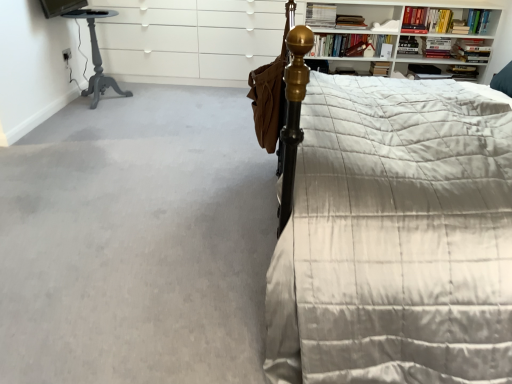
Question: Is matte gold bedpost at upper right further to camera compared to hardcover book at upper right, which is the seventh book in left-to-right order?

Choices:
 (A) yes
 (B) no

Answer: (B)

Question: From the image's perspective, does matte gold bedpost at upper right appear lower than hardcover book at upper right, arranged as the second book when viewed from the right?

Choices:
 (A) no
 (B) yes

Answer: (B)

Question: Is matte gold bedpost at upper right in contact with hardcover book at upper right, which is the seventh book in left-to-right order?

Choices:
 (A) yes
 (B) no

Answer: (B)

Question: Does matte gold bedpost at upper right have a greater width compared to hardcover book at upper right, which is the seventh book in left-to-right order?

Choices:
 (A) yes
 (B) no

Answer: (A)

Question: Is matte gold bedpost at upper right to the left of hardcover book at upper right, which is the seventh book in left-to-right order, from the viewer's perspective?

Choices:
 (A) no
 (B) yes

Answer: (B)

Question: From a real-world perspective, is matte gold bedpost at upper right above or below hardcover book at upper center, the 7th book positioned from the right?

Choices:
 (A) below
 (B) above

Answer: (A)

Question: Based on their sizes in the image, would you say matte gold bedpost at upper right is bigger or smaller than hardcover book at upper center, the 7th book positioned from the right?

Choices:
 (A) small
 (B) big

Answer: (B)

Question: In the image, is matte gold bedpost at upper right positioned in front of or behind hardcover book at upper center, the second book in the left-to-right sequence?

Choices:
 (A) behind
 (B) front

Answer: (B)

Question: From the image's perspective, is matte gold bedpost at upper right positioned above or below hardcover book at upper center, the 7th book positioned from the right?

Choices:
 (A) below
 (B) above

Answer: (A)

Question: Is hardcover book at upper right, marked as the 6th book in a left-to-right arrangement, to the left or to the right of matte gray table at left in the image?

Choices:
 (A) right
 (B) left

Answer: (A)

Question: From a real-world perspective, is hardcover book at upper right, the third book in the right-to-left sequence, above or below matte gray table at left?

Choices:
 (A) below
 (B) above

Answer: (B)

Question: Considering their positions, is hardcover book at upper right, marked as the 6th book in a left-to-right arrangement, located in front of or behind matte gray table at left?

Choices:
 (A) behind
 (B) front

Answer: (A)

Question: From the image's perspective, relative to matte gray table at left, is hardcover book at upper right, marked as the 6th book in a left-to-right arrangement, above or below?

Choices:
 (A) above
 (B) below

Answer: (A)

Question: Is point (457, 24) closer or farther from the camera than point (306, 23)?

Choices:
 (A) closer
 (B) farther

Answer: (B)

Question: Would you say hardcover book at upper right, positioned as the 5th book in right-to-left order, is inside or outside hardcover book at upper center, which is the 1th book in left-to-right order?

Choices:
 (A) outside
 (B) inside

Answer: (A)